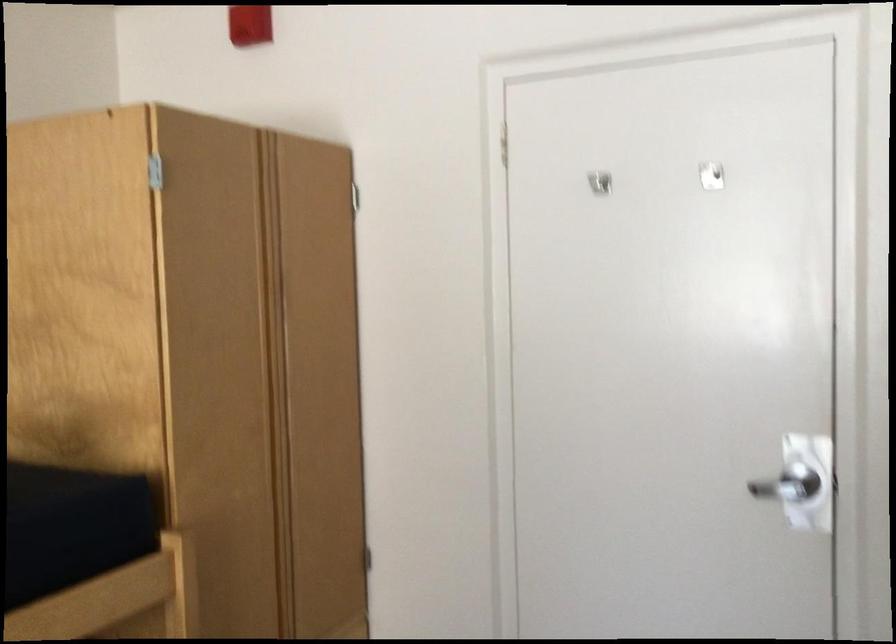
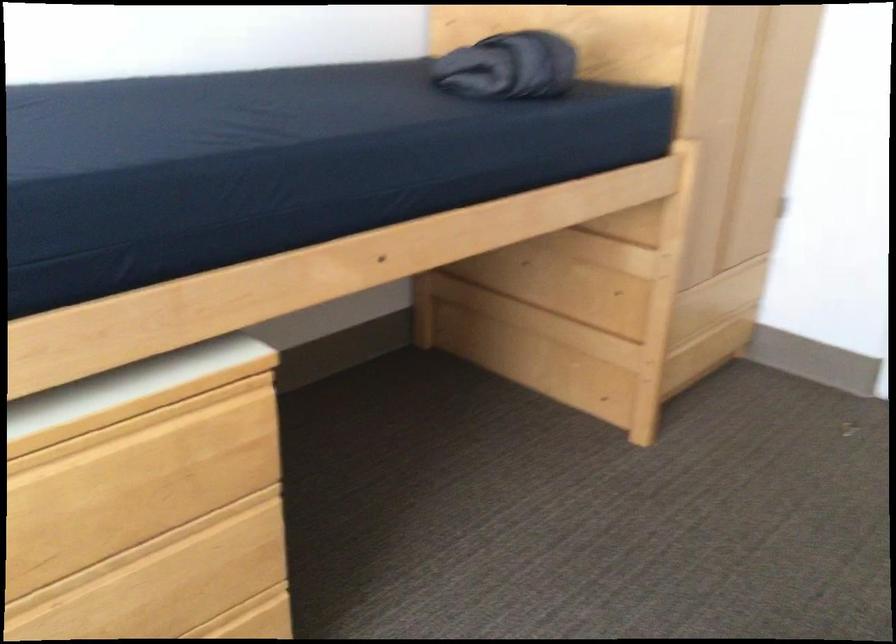
First-person continuous shooting, in which direction is the camera rotating?

The camera's rotation is toward left-down.